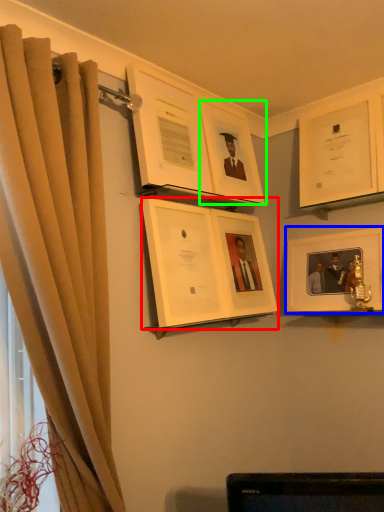
Question: Which object is positioned closest to picture frame (highlighted by a red box)? Select from picture frame (highlighted by a blue box) and picture frame (highlighted by a green box).

Choices:
 (A) picture frame
 (B) picture frame

Answer: (B)